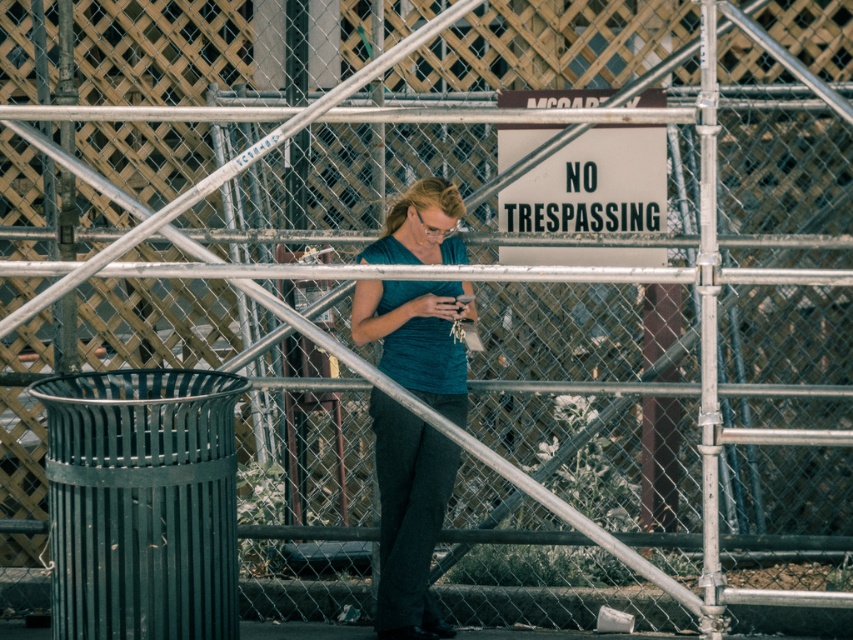
You are standing in the urban scene depicted. You want to hand a document to the person wearing the teal fabric shirt at center without approaching them. You have a long stick that can reach 25 feet. Can you reach them using the stick?

The teal fabric shirt at center is 24.77 feet from the viewer. Since the stick can reach 25 feet, you can just barely reach them with the stick.

You are a delivery person trying to read the white plastic sign at center while holding a teal fabric shirt at center in your arms. Can you comfortably hold both items without dropping either?

Answer: The teal fabric shirt at center and white plastic sign at center are 31.65 inches apart, so yes, you can comfortably hold both items without dropping either as the distance between them allows for stable handling.

You are a photographer trying to capture a clear photo of the white plastic sign at center. The teal fabric shirt at center is blocking part of the view. Which object should you move closer to the camera to ensure the sign is fully visible?

The teal fabric shirt at center has a greater height compared to the white plastic sign at center, so moving the teal fabric shirt at center closer to the camera would reduce its obstruction of the sign, allowing the white plastic sign at center to be fully visible.